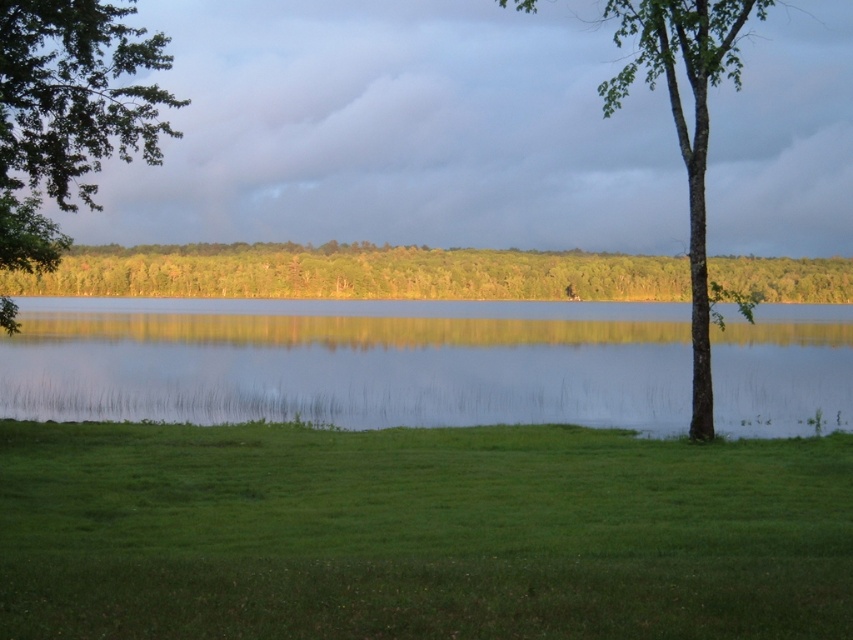
Question: Among these objects, which one is farthest from the camera?

Choices:
 (A) green smooth bark tree at right
 (B) green leafy tree at upper left
 (C) green leafy tree at center

Answer: (C)

Question: In this image, where is green leafy tree at center located relative to green leafy tree at upper left?

Choices:
 (A) below
 (B) above

Answer: (A)

Question: Is clear water at center below green leafy tree at center?

Choices:
 (A) yes
 (B) no

Answer: (A)

Question: Is clear water at center behind green leafy tree at upper left?

Choices:
 (A) no
 (B) yes

Answer: (B)

Question: Which point is closer to the camera taking this photo?

Choices:
 (A) (738, 1)
 (B) (148, 378)

Answer: (A)

Question: Which is farther from the green grassy at lower center?

Choices:
 (A) green leafy tree at upper left
 (B) clear water at center

Answer: (B)